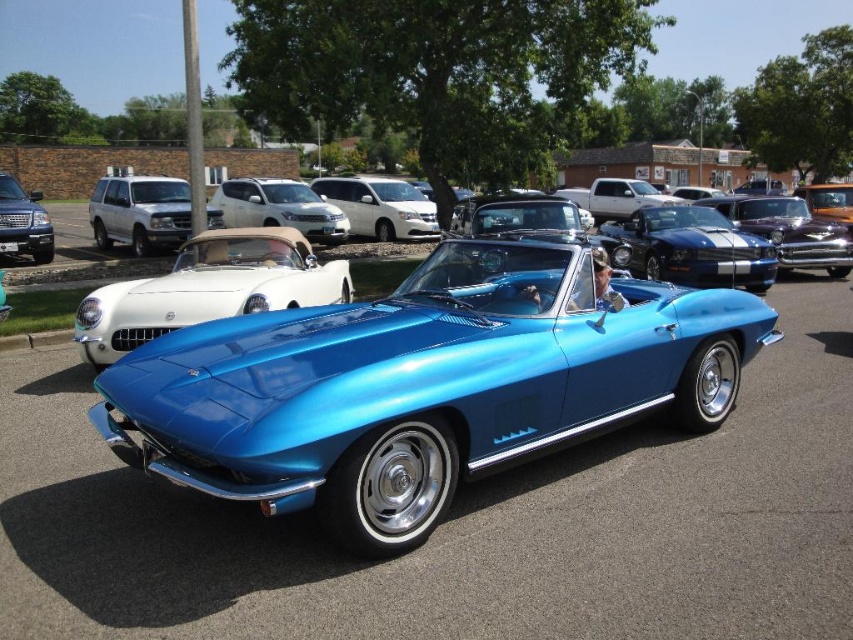
Question: Observing the image, what is the correct spatial positioning of shiny blue convertible at center in reference to shiny metallic car at center?

Choices:
 (A) above
 (B) below

Answer: (B)

Question: Which object is positioned closest to the shiny white convertible at center?

Choices:
 (A) satin white minivan at center
 (B) shiny metallic car at center
 (C) matte white truck at center
 (D) metallic blue car at center

Answer: (D)

Question: Can you confirm if matte white suv at upper left is positioned above matte white convertible at center?

Choices:
 (A) yes
 (B) no

Answer: (A)

Question: Does matte white suv at upper left appear on the left side of matte silver suv at left?

Choices:
 (A) no
 (B) yes

Answer: (B)

Question: Which point appears farthest from the camera in this image?

Choices:
 (A) (16, 188)
 (B) (225, 566)
 (C) (407, 192)

Answer: (C)

Question: Which point is closer to the camera taking this photo?

Choices:
 (A) (646, 211)
 (B) (328, 189)
 (C) (77, 317)
 (D) (589, 202)

Answer: (C)